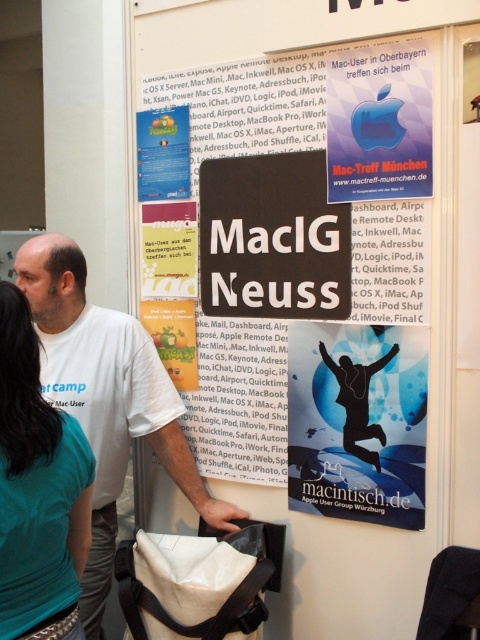
In the image, there is a black cardboard sign at center and a white bag with black straps. Where is the point located at coordinates (x=240, y=401) in relation to these objects?

The point at coordinates (x=240, y=401) corresponds to the black cardboard sign at center.